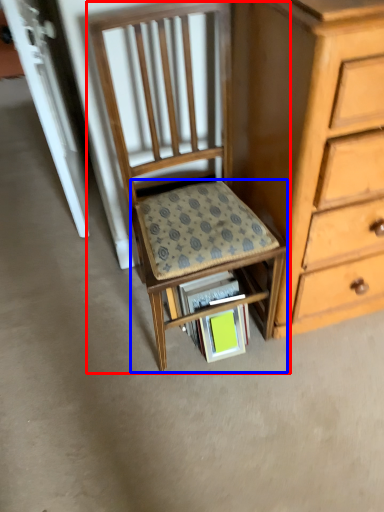
Question: Among these objects, which one is nearest to the camera, chair (highlighted by a red box) or step stool (highlighted by a blue box)?

Choices:
 (A) chair
 (B) step stool

Answer: (A)